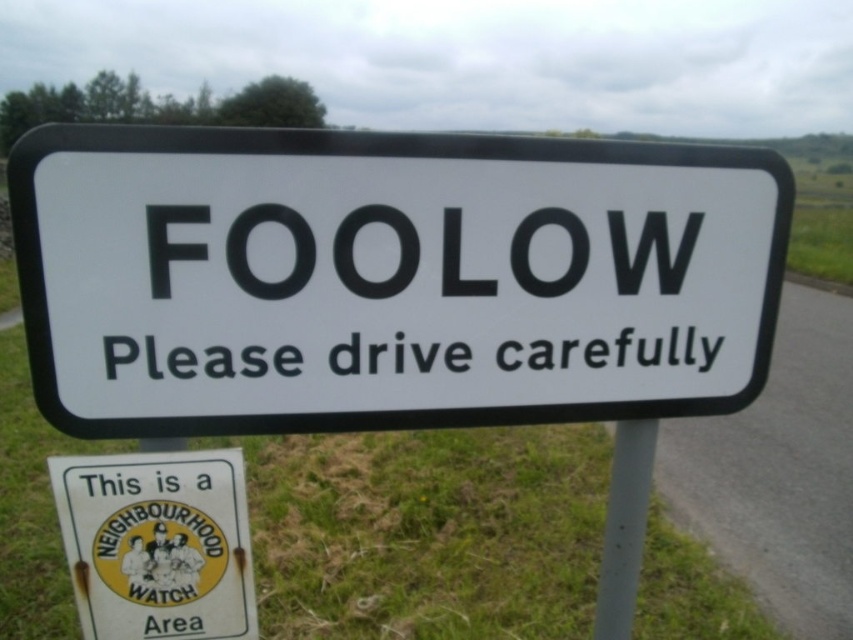
Question: Can you confirm if black matte text at center is positioned above white metallic pole at center?

Choices:
 (A) yes
 (B) no

Answer: (A)

Question: Which point is closer to the camera?

Choices:
 (A) (201, 170)
 (B) (567, 355)
 (C) (599, 595)

Answer: (A)

Question: Which of these objects is positioned closest to the black matte text at center?

Choices:
 (A) white metallic pole at center
 (B) yellow paper sign at lower left
 (C) white plastic sign at center

Answer: (C)

Question: Which object appears closest to the camera in this image?

Choices:
 (A) black matte text at center
 (B) white metallic pole at center

Answer: (A)

Question: Is white plastic sign at center further to camera compared to white metallic pole at center?

Choices:
 (A) yes
 (B) no

Answer: (B)

Question: Does yellow paper sign at lower left have a larger size compared to white metallic pole at center?

Choices:
 (A) yes
 (B) no

Answer: (A)